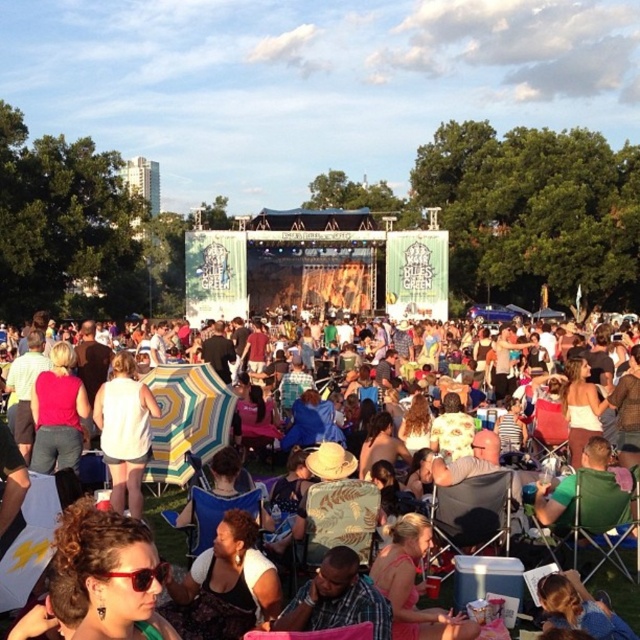
You are attending an outdoor concert and want to protect yourself from the sun. You have a white fabric umbrella at lower left and a white matte dress at center. Which item can provide more shade coverage?

The white fabric umbrella at lower left is larger in size than the white matte dress at center, so it can provide more shade coverage.

You are at the concert and want to know if the white fabric umbrella at lower left can provide shade to the white matte dress at center. Considering their sizes, is the umbrella wide enough to cover the dress?

The white fabric umbrella at lower left is wider than the white matte dress at center, so yes, it can provide sufficient shade to cover the dress.

You are at the concert and want to sit down. You see a plastic folding chair at center and a green fabric chair at lower right. Which chair is closer to you?

The plastic folding chair at center is closer to you because the green fabric chair at lower right is behind it.